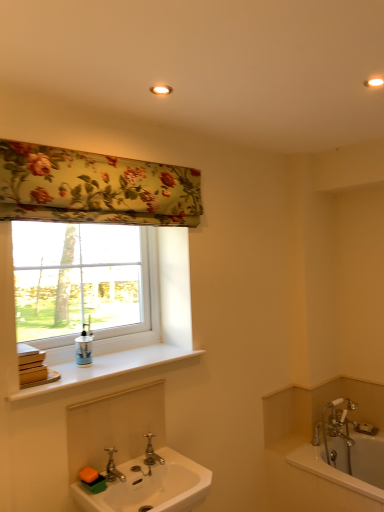
Locate an element on the screen. Image resolution: width=384 pixels, height=512 pixels. vacant region above white matte window sill at upper left (from a real-world perspective) is located at coordinates (102, 361).